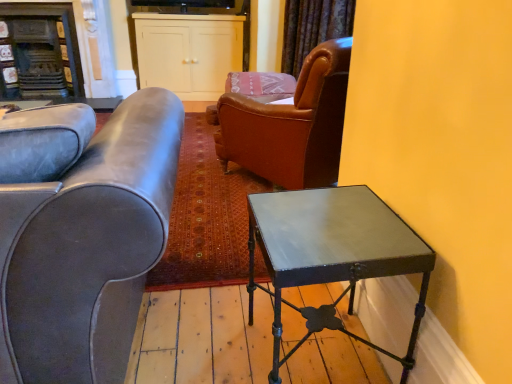
Question: Do you think metallic dark green table at right is within dark brown wood fireplace at upper left, or outside of it?

Choices:
 (A) inside
 (B) outside

Answer: (B)

Question: From a real-world perspective, is metallic dark green table at right above or below dark brown wood fireplace at upper left?

Choices:
 (A) below
 (B) above

Answer: (A)

Question: Considering the real-world distances, which object is closest to the velvet dark brown curtain at upper center?

Choices:
 (A) white matte cabinet at upper center
 (B) metallic dark green table at right
 (C) leather couch at left
 (D) dark brown wood fireplace at upper left

Answer: (A)

Question: Estimate the real-world distances between objects in this image. Which object is farther from the leather couch at left?

Choices:
 (A) metallic dark green table at right
 (B) dark brown wood fireplace at upper left
 (C) white matte cabinet at upper center
 (D) velvet dark brown curtain at upper center

Answer: (B)